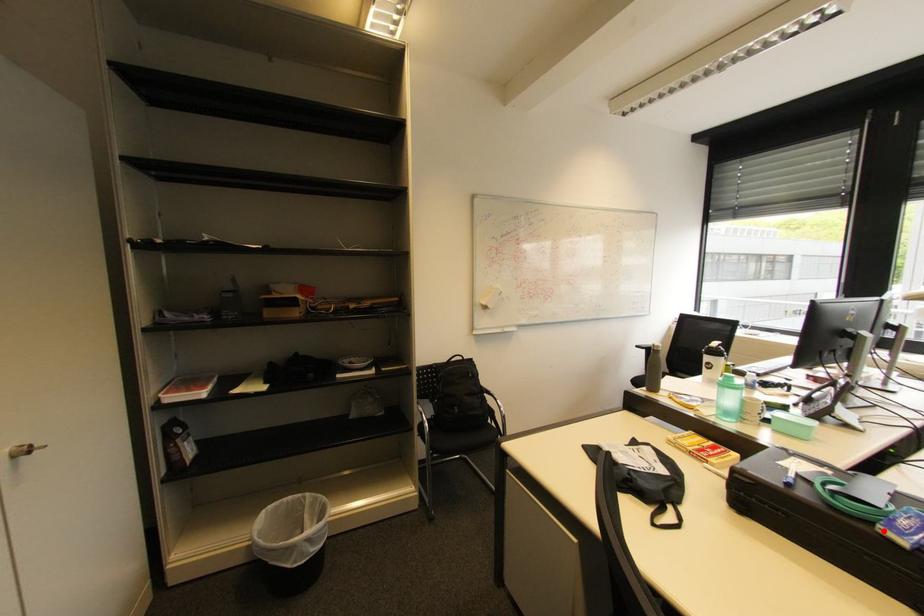
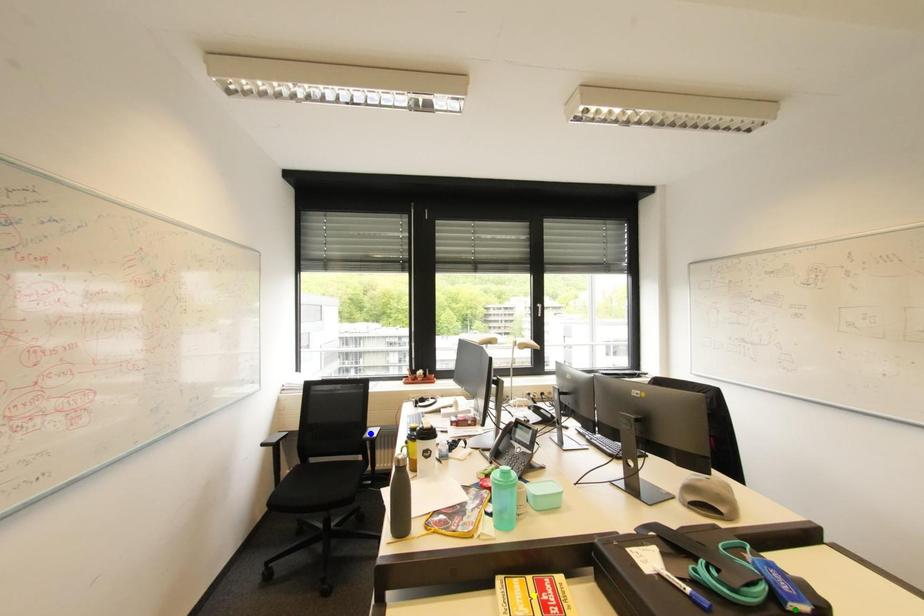
Question: I am providing you with two images of the same scene from different viewpoints. A red point is marked on the first image. You are given multiple points on the second image. Which point in image 2 is actually the same real-world point as the red point in image 1?

Choices:
 (A) green point
 (B) yellow point
 (C) blue point

Answer: (A)